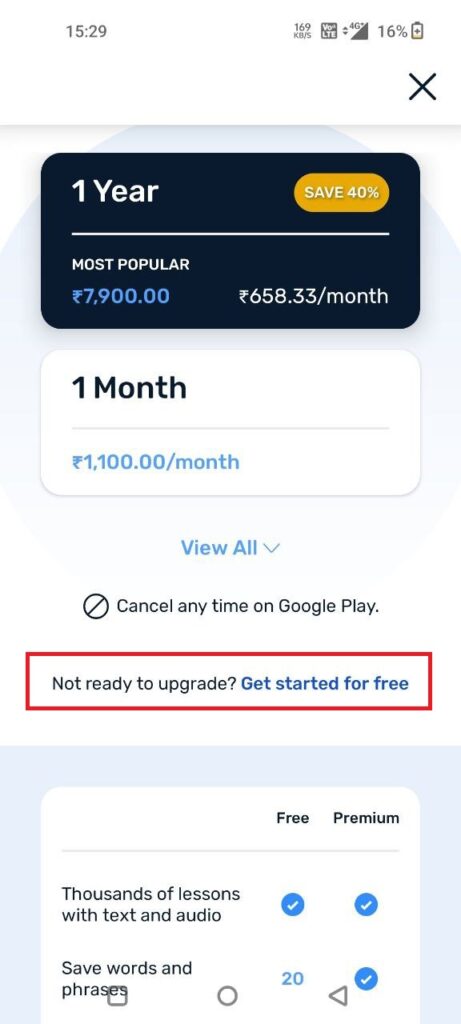
At what (x,y) coordinates should I click in order to perform the action: click on time display. Please return your answer as a coordinate pair (x, y). The image size is (461, 1024). Looking at the image, I should click on (96, 33).